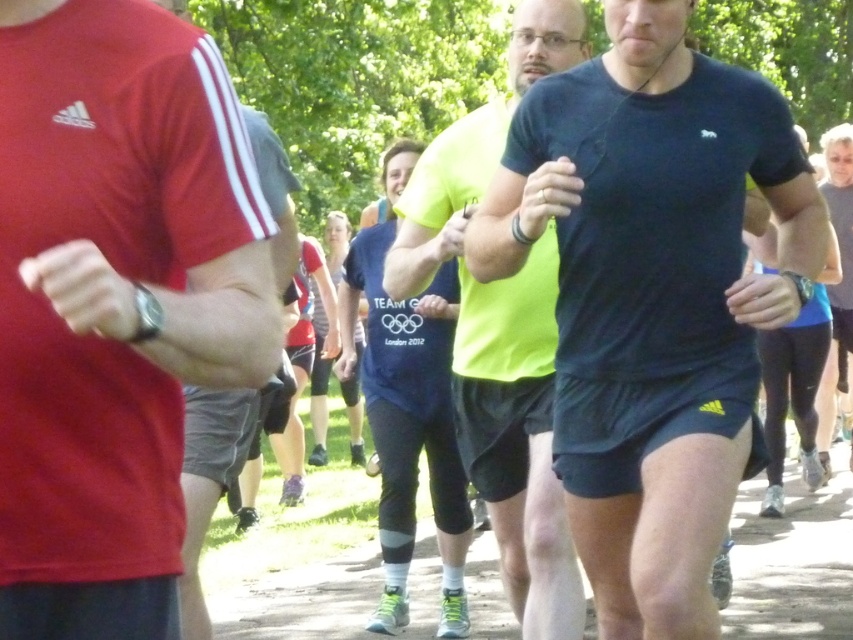
Question: Observing the image, what is the correct spatial positioning of matte red t-shirt at left in reference to blue fabric shirt at center?

Choices:
 (A) right
 (B) left

Answer: (B)

Question: Which of these objects is positioned closest to the blue fabric shirt at center?

Choices:
 (A) matte red t-shirt at left
 (B) dark blue t-shirt at center
 (C) matte black t-shirt at center

Answer: (C)

Question: Among these objects, which one is nearest to the camera?

Choices:
 (A) dark blue t-shirt at center
 (B) blue fabric shirt at center

Answer: (A)

Question: Which point is closer to the camera?

Choices:
 (A) (836, 332)
 (B) (180, 406)
 (C) (445, 556)
 (D) (730, 221)

Answer: (B)

Question: Can you confirm if dark blue t-shirt at center is positioned to the left of matte black t-shirt at center?

Choices:
 (A) no
 (B) yes

Answer: (A)

Question: Can you confirm if matte black t-shirt at center is smaller than blue fabric shirt at center?

Choices:
 (A) yes
 (B) no

Answer: (A)